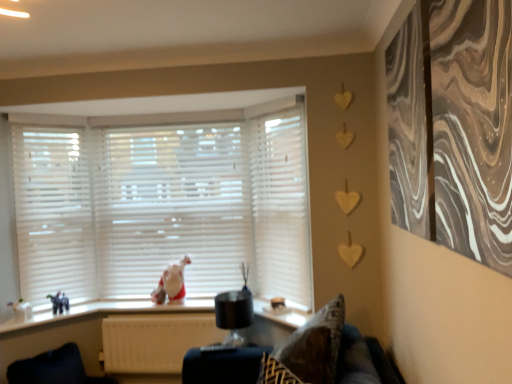
Find the location of a particular element. vacant space underneath white glossy chicken at center (from a real-world perspective) is located at coordinates point(169,303).